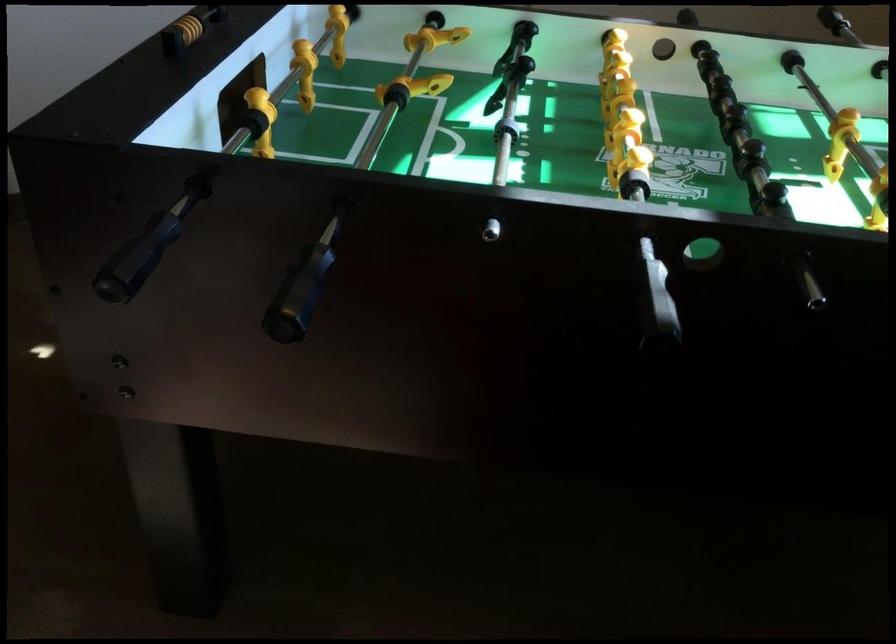
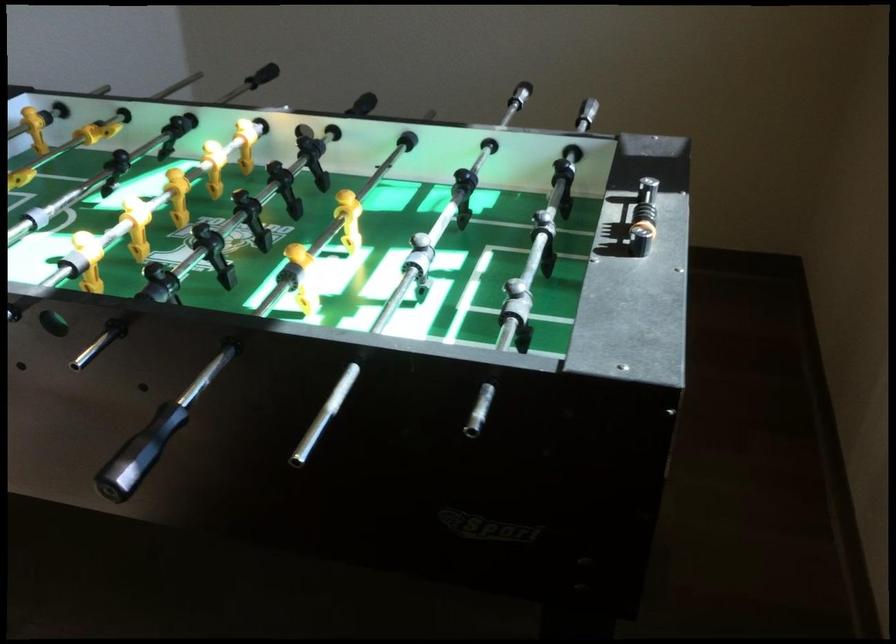
Question: The images are taken continuously from a first-person perspective. In which direction are you moving?

Choices:
 (A) Left
 (B) Right
 (C) Forward
 (D) Backward

Answer: (B)